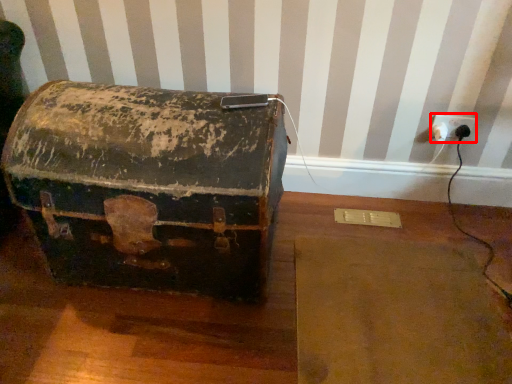
Question: From the image's perspective, what is the correct spatial relationship of electric outlet (annotated by the red box) in relation to box?

Choices:
 (A) below
 (B) above

Answer: (B)